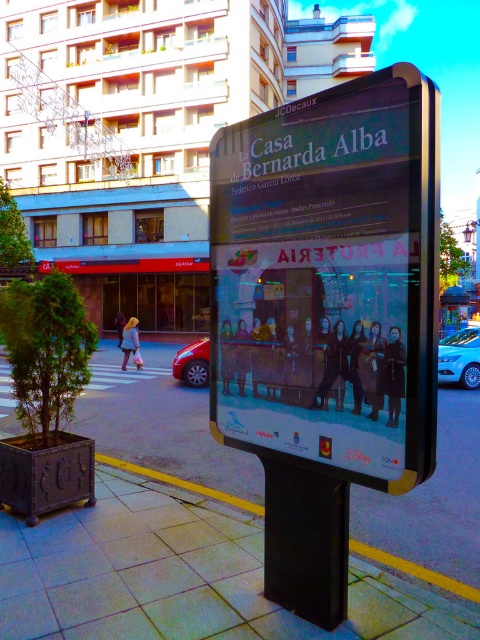
Between metallic poster at center and shiny red car at center, which one has more height?

metallic poster at center

This screenshot has width=480, height=640. Describe the element at coordinates (328, 280) in the screenshot. I see `metallic poster at center` at that location.

This screenshot has width=480, height=640. What are the coordinates of `metallic poster at center` in the screenshot? It's located at (328, 280).

Is smooth concrete pavement at center positioned in front of blue metallic car at lower right?

Answer: That is False.

Is smooth concrete pavement at center wider than blue metallic car at lower right?

Yes.

Is point (2, 406) farther from camera compared to point (454, 358)?

No, it is not.

This screenshot has width=480, height=640. I want to click on smooth concrete pavement at center, so click(160, 424).

Is point (369, 372) farther from camera compared to point (120, 417)?

That is False.

From the picture: Is metallic poster at center above smooth concrete pavement at center?

Correct, metallic poster at center is located above smooth concrete pavement at center.

Who is more distant from viewer, (373,291) or (435,548)?

Point (435,548)

At what (x,y) coordinates should I click in order to perform the action: click on metallic poster at center. Please return your answer as a coordinate pair (x, y). Looking at the image, I should click on (328, 280).